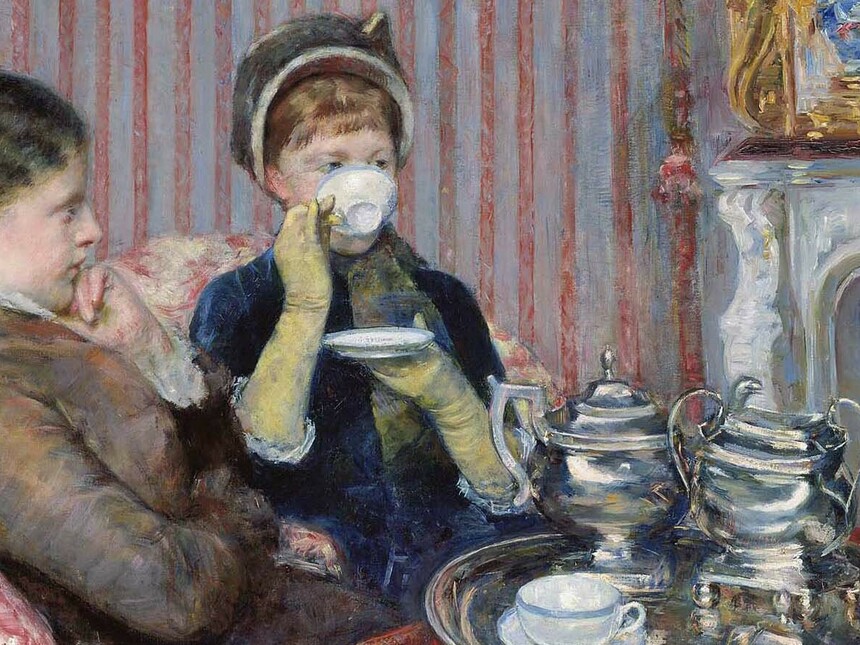
Where is `tea pot`? tea pot is located at coordinates pos(622,497), pos(760,491).